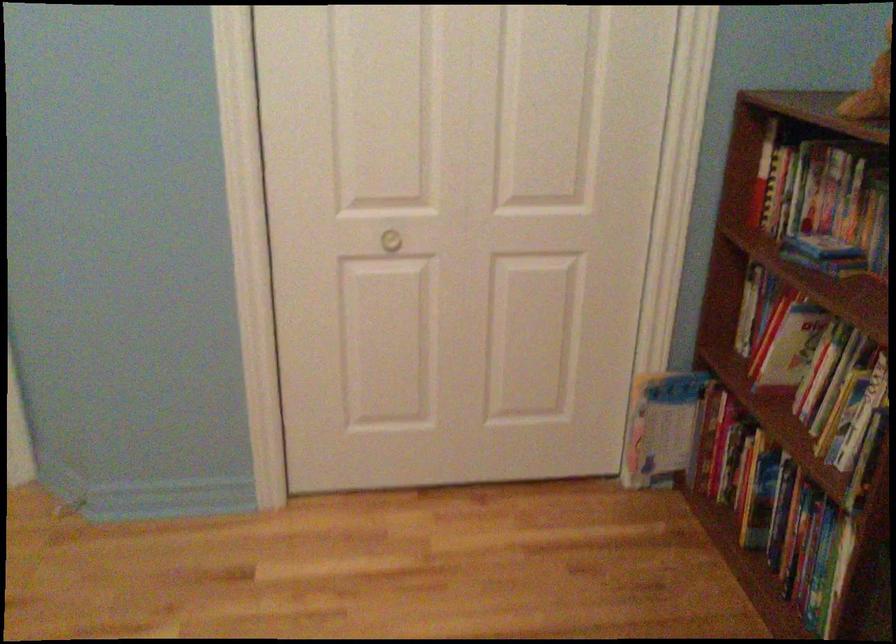
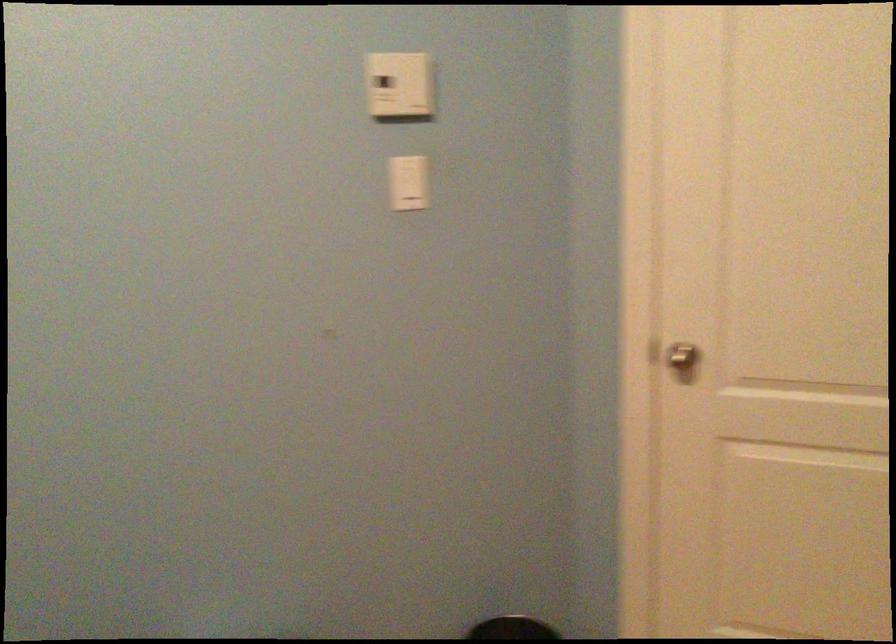
Question: The first image is from the beginning of the video and the second image is from the end. How did the camera likely rotate when shooting the video?

Choices:
 (A) Left
 (B) Right
 (C) Up
 (D) Down

Answer: (A)